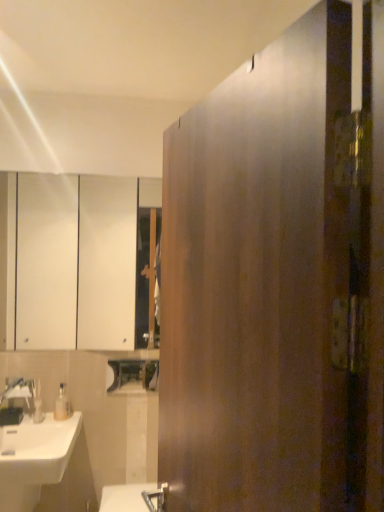
Question: Considering the relative sizes of satin wood door at center and translucent plastic soap dispenser at lower left in the image provided, is satin wood door at center thinner than translucent plastic soap dispenser at lower left?

Choices:
 (A) no
 (B) yes

Answer: (A)

Question: Could you tell me if satin wood door at center is facing translucent plastic soap dispenser at lower left?

Choices:
 (A) yes
 (B) no

Answer: (B)

Question: Is satin wood door at center turned away from translucent plastic soap dispenser at lower left?

Choices:
 (A) no
 (B) yes

Answer: (A)

Question: From the image's perspective, is satin wood door at center located beneath translucent plastic soap dispenser at lower left?

Choices:
 (A) yes
 (B) no

Answer: (B)

Question: Can translucent plastic soap dispenser at lower left be found inside satin wood door at center?

Choices:
 (A) no
 (B) yes

Answer: (A)

Question: From a real-world perspective, is satin wood door at center under translucent plastic soap dispenser at lower left?

Choices:
 (A) yes
 (B) no

Answer: (B)

Question: From a real-world perspective, is translucent plastic soap dispenser at lower left beneath satin wood door at center?

Choices:
 (A) no
 (B) yes

Answer: (B)

Question: Does translucent plastic soap dispenser at lower left come behind satin wood door at center?

Choices:
 (A) no
 (B) yes

Answer: (B)

Question: Is satin wood door at center completely or partially inside translucent plastic soap dispenser at lower left?

Choices:
 (A) yes
 (B) no

Answer: (B)

Question: Is translucent plastic soap dispenser at lower left facing towards satin wood door at center?

Choices:
 (A) no
 (B) yes

Answer: (A)

Question: Is translucent plastic soap dispenser at lower left oriented away from satin wood door at center?

Choices:
 (A) yes
 (B) no

Answer: (B)

Question: Does translucent plastic soap dispenser at lower left have a lesser width compared to satin wood door at center?

Choices:
 (A) no
 (B) yes

Answer: (B)

Question: Is satin wood door at center closer to camera compared to brushed metal faucet at lower left?

Choices:
 (A) no
 (B) yes

Answer: (B)